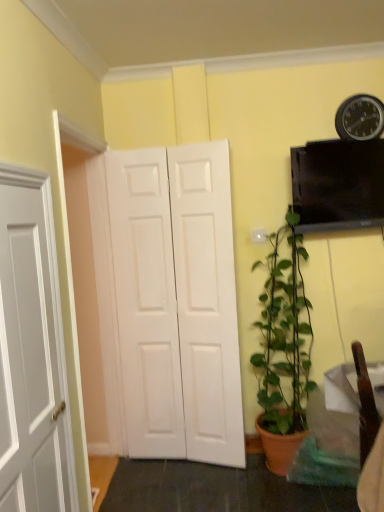
Question: Could white matte door at center be considered to be inside metallic black clock at upper right?

Choices:
 (A) yes
 (B) no

Answer: (B)

Question: Is metallic black clock at upper right not inside white matte door at center?

Choices:
 (A) no
 (B) yes

Answer: (B)

Question: Considering the relative sizes of metallic black clock at upper right and white matte door at center in the image provided, is metallic black clock at upper right wider than white matte door at center?

Choices:
 (A) no
 (B) yes

Answer: (A)

Question: From the image's perspective, is metallic black clock at upper right above white matte door at center?

Choices:
 (A) no
 (B) yes

Answer: (B)

Question: Is metallic black clock at upper right behind white matte door at center?

Choices:
 (A) no
 (B) yes

Answer: (B)

Question: Does point (253, 265) appear closer or farther from the camera than point (362, 132)?

Choices:
 (A) closer
 (B) farther

Answer: (B)

Question: From the image's perspective, is green matte plant at lower right above or below metallic black clock at upper right?

Choices:
 (A) above
 (B) below

Answer: (B)

Question: Would you say green matte plant at lower right is to the left or to the right of metallic black clock at upper right in the picture?

Choices:
 (A) right
 (B) left

Answer: (B)

Question: Is green matte plant at lower right inside or outside of metallic black clock at upper right?

Choices:
 (A) inside
 (B) outside

Answer: (B)

Question: Considering the positions of point (347, 133) and point (167, 347), is point (347, 133) closer or farther from the camera than point (167, 347)?

Choices:
 (A) farther
 (B) closer

Answer: (B)

Question: Based on their sizes in the image, would you say metallic black clock at upper right is bigger or smaller than white matte door at center?

Choices:
 (A) big
 (B) small

Answer: (B)

Question: Is metallic black clock at upper right wider or thinner than white matte door at center?

Choices:
 (A) wide
 (B) thin

Answer: (B)

Question: In the image, is metallic black clock at upper right on the left side or the right side of white matte door at center?

Choices:
 (A) left
 (B) right

Answer: (B)

Question: Looking at their shapes, would you say white matte door at center is wider or thinner than green matte plant at lower right?

Choices:
 (A) wide
 (B) thin

Answer: (B)

Question: From the image's perspective, relative to green matte plant at lower right, is white matte door at center above or below?

Choices:
 (A) below
 (B) above

Answer: (B)